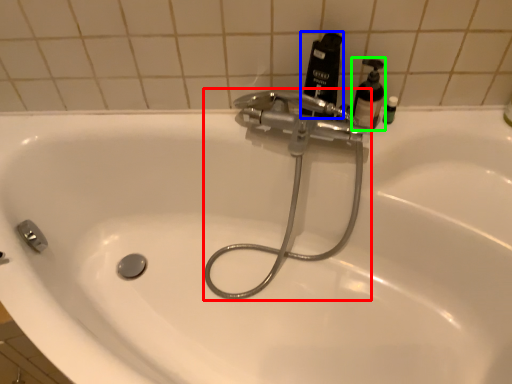
Question: Which object is positioned closest to plumbing fixture (highlighted by a red box)? Select from mouthwash (highlighted by a blue box) and soap dispenser (highlighted by a green box).

Choices:
 (A) mouthwash
 (B) soap dispenser

Answer: (A)